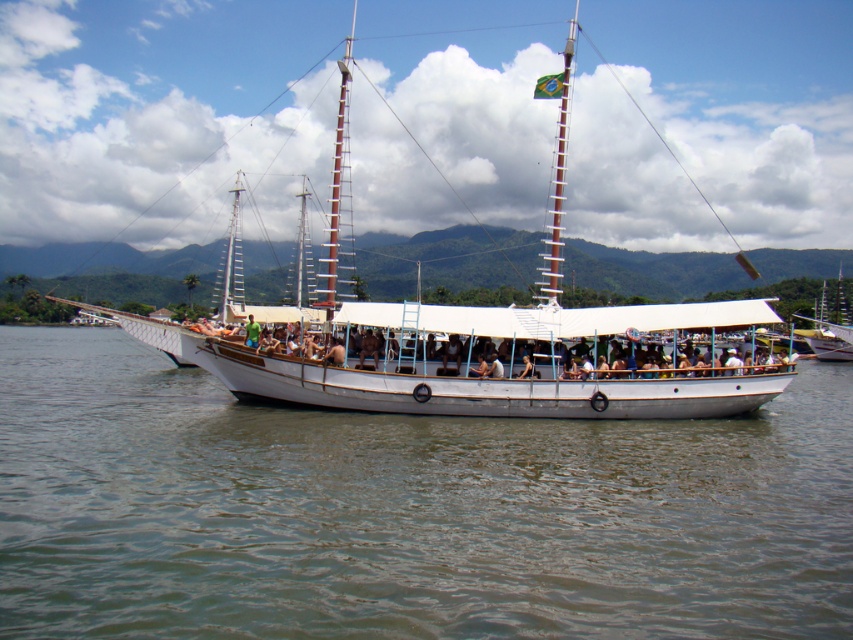
Does clear water at center have a lesser width compared to white wooden boat at center?

Yes, clear water at center is thinner than white wooden boat at center.

Does clear water at center have a larger size compared to white wooden boat at center?

Incorrect, clear water at center is not larger than white wooden boat at center.

This screenshot has width=853, height=640. Find the location of `clear water at center`. clear water at center is located at coordinates (404, 512).